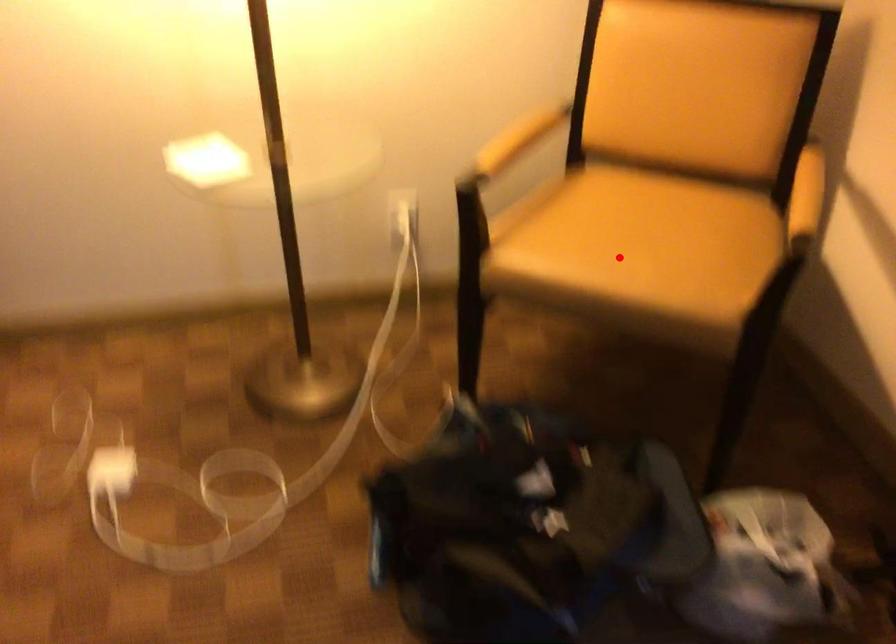
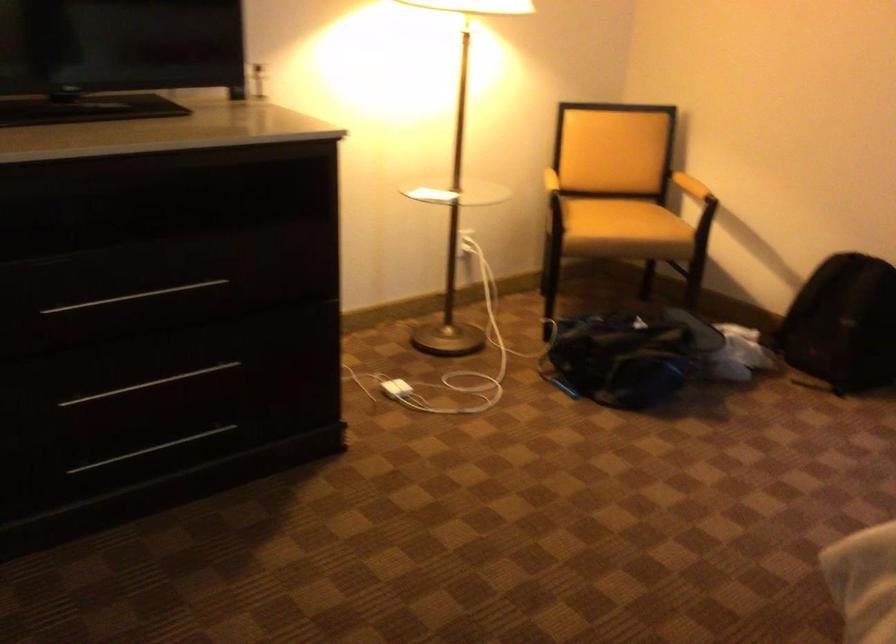
Question: I am providing you with two images of the same scene from different viewpoints. Given a red point in image1, look at the same physical point in image2. Is it:

Choices:
 (A) Closer to the viewpoint
 (B) Farther from the viewpoint

Answer: (B)